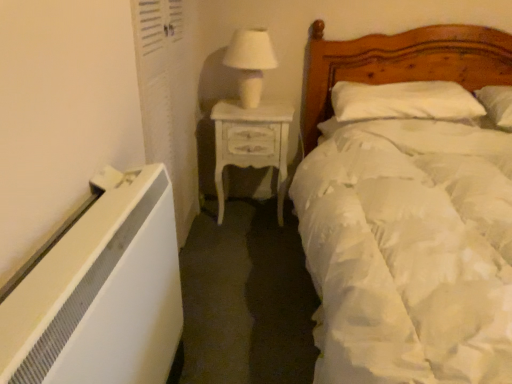
Question: Is wooden bed at right turned away from white soft pillow at upper right?

Choices:
 (A) no
 (B) yes

Answer: (B)

Question: Is the position of wooden bed at right more distant than that of white soft pillow at upper right?

Choices:
 (A) yes
 (B) no

Answer: (B)

Question: Does wooden bed at right have a larger size compared to white soft pillow at upper right?

Choices:
 (A) yes
 (B) no

Answer: (A)

Question: Is wooden bed at right positioned in front of white soft pillow at upper right?

Choices:
 (A) no
 (B) yes

Answer: (B)

Question: Is wooden bed at right far from white soft pillow at upper right?

Choices:
 (A) no
 (B) yes

Answer: (A)

Question: Do you think wooden bed at right is within white painted wood nightstand at center, or outside of it?

Choices:
 (A) outside
 (B) inside

Answer: (A)

Question: Is wooden bed at right wider or thinner than white painted wood nightstand at center?

Choices:
 (A) wide
 (B) thin

Answer: (A)

Question: In the image, is wooden bed at right positioned in front of or behind white painted wood nightstand at center?

Choices:
 (A) behind
 (B) front

Answer: (B)

Question: In terms of height, does wooden bed at right look taller or shorter compared to white painted wood nightstand at center?

Choices:
 (A) short
 (B) tall

Answer: (B)

Question: Is white glossy table lamp at upper center in front of or behind white painted wood nightstand at center in the image?

Choices:
 (A) behind
 (B) front

Answer: (B)

Question: Is white glossy table lamp at upper center spatially inside white painted wood nightstand at center, or outside of it?

Choices:
 (A) outside
 (B) inside

Answer: (A)

Question: Considering the positions of white glossy table lamp at upper center and white painted wood nightstand at center in the image, is white glossy table lamp at upper center taller or shorter than white painted wood nightstand at center?

Choices:
 (A) tall
 (B) short

Answer: (B)

Question: Looking at the image, does white glossy table lamp at upper center seem bigger or smaller compared to white painted wood nightstand at center?

Choices:
 (A) big
 (B) small

Answer: (B)

Question: Is white painted wood nightstand at center wider or thinner than white glossy table lamp at upper center?

Choices:
 (A) wide
 (B) thin

Answer: (A)

Question: Is white painted wood nightstand at center taller or shorter than white glossy table lamp at upper center?

Choices:
 (A) tall
 (B) short

Answer: (A)